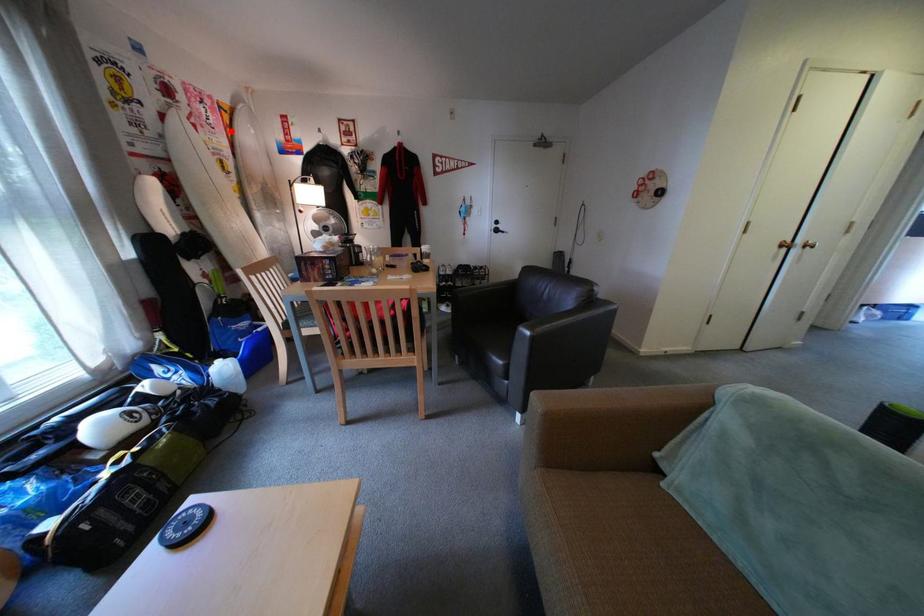
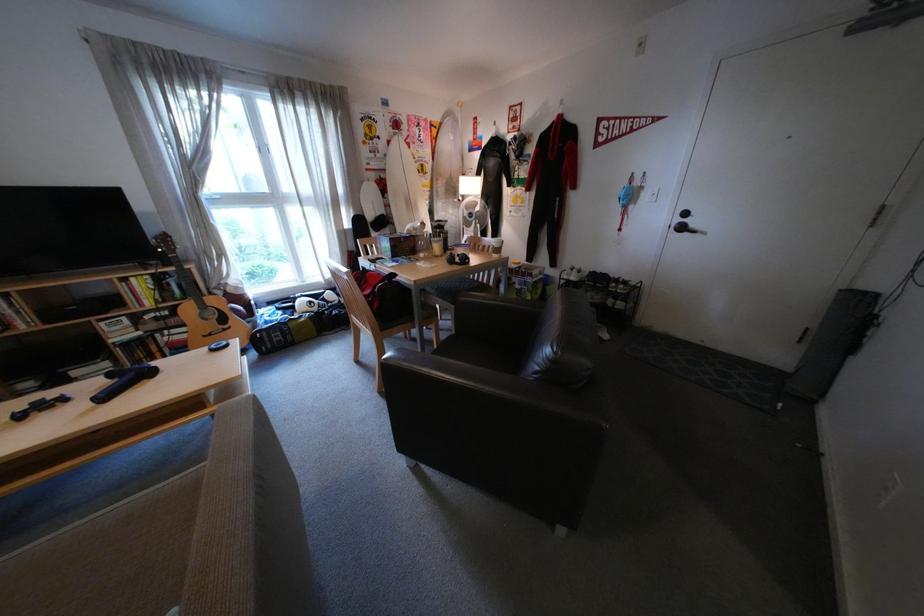
Question: I am providing you with two images of the same scene from different viewpoints. Image1 has a red point marked. In image2, the corresponding 3D location appears at what relative position? Reply with the corresponding letter.

Choices:
 (A) Closer
 (B) Farther

Answer: (A)